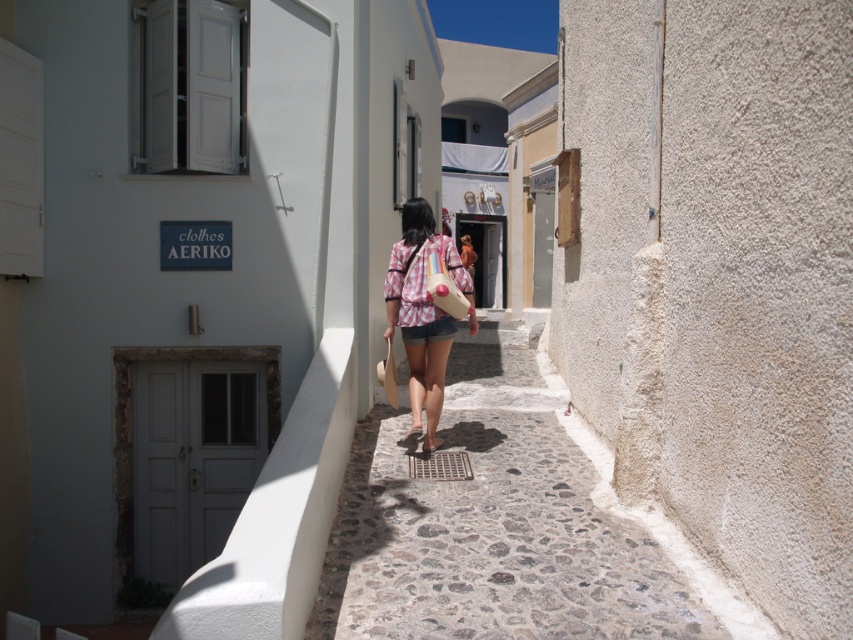
You are a delivery person carrying a large package that is 1.2 meters wide. You need to navigate through the narrow alleyway shown in the image. Can you pass through the cobblestone alley at center while also avoiding the pink plaid shirt at center?

The cobblestone alley at center might be wider than the pink plaid shirt at center, so there is a possibility that the delivery person can pass through the alley if the width is sufficient. However, the exact width isn not specified, so caution is advised.

Based on the photo, you are standing at the entrance of the alleyway and see a point marked at coordinates (x=492, y=528). Based on the scene description, where is this point located?

The point (x=492, y=528) is located on the cobblestone alley at center.

You are standing in the cobblestone alley at center and want to pick up the brown leather sandal at center. In which direction should you move to reach it?

The brown leather sandal at center is to the left of the cobblestone alley at center, so you should move to your left to reach it.